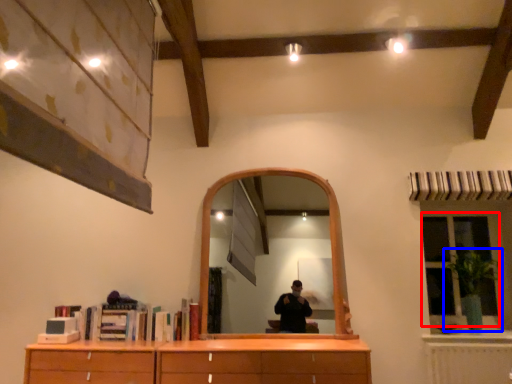
Question: Which of the following is the closest to the observer, window (highlighted by a red box) or plant (highlighted by a blue box)?

Choices:
 (A) window
 (B) plant

Answer: (B)